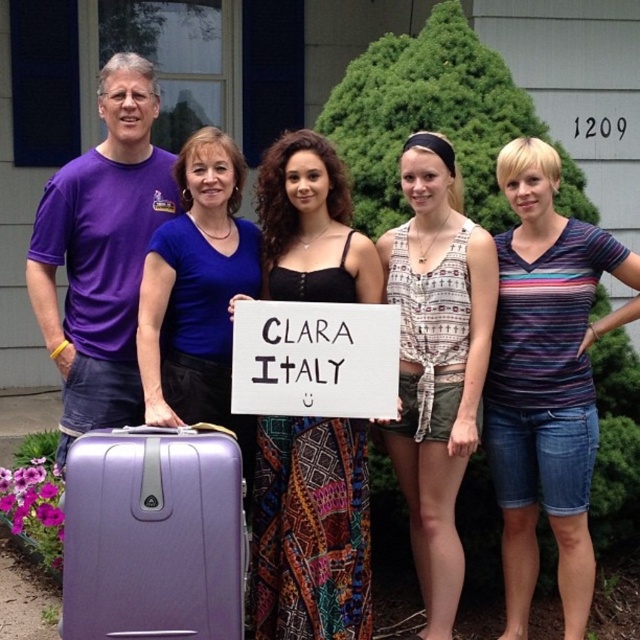
Question: From the image, what is the correct spatial relationship of striped cotton shirt at center in relation to white paper sign at center?

Choices:
 (A) above
 (B) below

Answer: (B)

Question: Which point is farther to the camera?

Choices:
 (A) white paper sign at center
 (B) striped cotton shirt at center
 (C) matte purple suitcase at left

Answer: (B)

Question: Is black textured dress at center closer to the viewer compared to white paper sign at center?

Choices:
 (A) no
 (B) yes

Answer: (A)

Question: Which of these objects is positioned farthest from the lavender textured suitcase at lower left?

Choices:
 (A) black textured dress at center
 (B) matte purple suitcase at left

Answer: (A)

Question: Can you confirm if lavender textured suitcase at lower left is bigger than white paper sign at center?

Choices:
 (A) yes
 (B) no

Answer: (A)

Question: Which of these objects is positioned closest to the white paper sign at center?

Choices:
 (A) patterned fabric tank top at center
 (B) matte purple suitcase at left

Answer: (B)